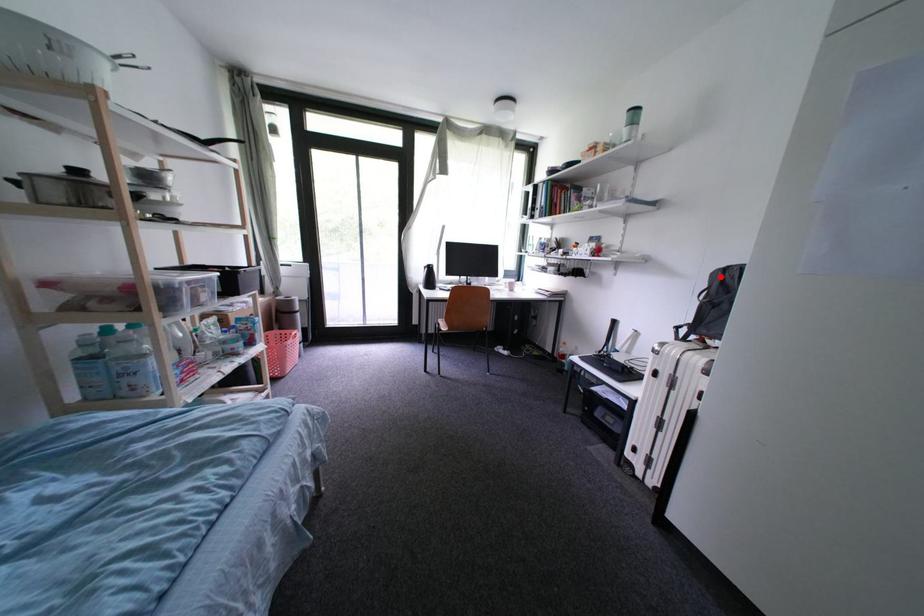
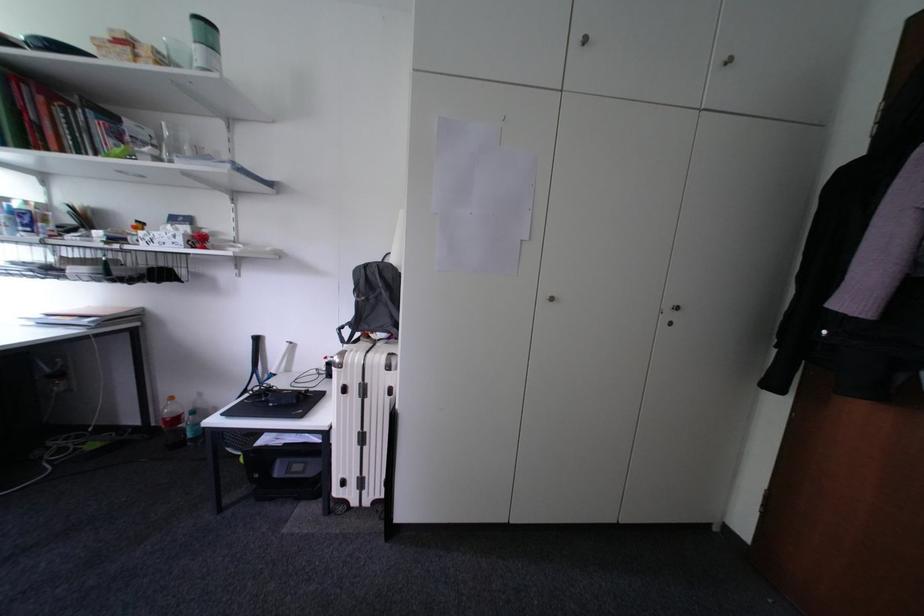
Where in the second image is the point corresponding to the highlighted location from the first image?

(363, 274)